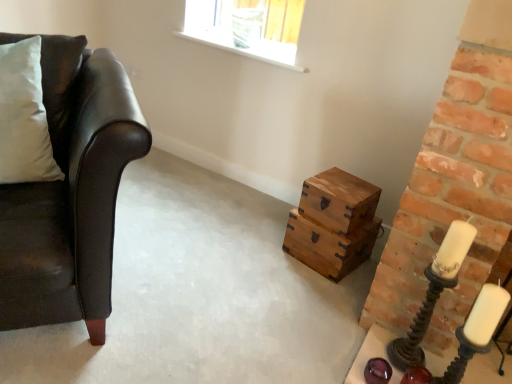
What are the coordinates of `unoccupied space behind matte black leather couch at left` in the screenshot? It's located at (185, 201).